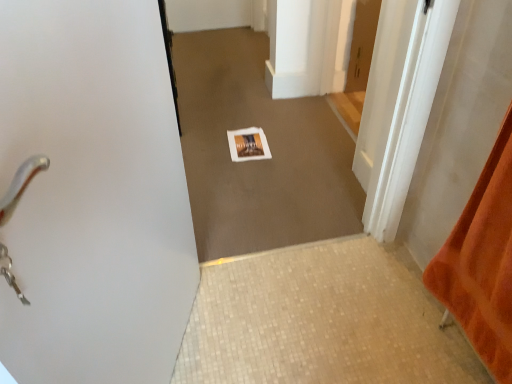
Question: Is orange fabric at right looking in the opposite direction of wooden door at center, arranged as the 2th door when viewed from the back?

Choices:
 (A) no
 (B) yes

Answer: (A)

Question: Is orange fabric at right touching wooden door at center, arranged as the 2th door when viewed from the back?

Choices:
 (A) no
 (B) yes

Answer: (A)

Question: From the image's perspective, does orange fabric at right appear lower than wooden door at center, the first door when ordered from front to back?

Choices:
 (A) yes
 (B) no

Answer: (A)

Question: Can you confirm if orange fabric at right is taller than wooden door at center, the first door when ordered from front to back?

Choices:
 (A) yes
 (B) no

Answer: (A)

Question: From a real-world perspective, does orange fabric at right sit lower than wooden door at center, the first door when ordered from front to back?

Choices:
 (A) no
 (B) yes

Answer: (A)

Question: Considering their positions, is wooden door at center, arranged as the 2th door when viewed from the back, located in front of or behind beige mosaic tile at lower center?

Choices:
 (A) front
 (B) behind

Answer: (B)

Question: Is wooden door at center, the first door when ordered from front to back, inside or outside of beige mosaic tile at lower center?

Choices:
 (A) outside
 (B) inside

Answer: (A)

Question: Is wooden door at center, arranged as the 2th door when viewed from the back, taller or shorter than beige mosaic tile at lower center?

Choices:
 (A) tall
 (B) short

Answer: (A)

Question: Is wooden door at center, arranged as the 2th door when viewed from the back, wider or thinner than beige mosaic tile at lower center?

Choices:
 (A) thin
 (B) wide

Answer: (A)

Question: Is wooden door at center, the first door when ordered from front to back, wider or thinner than white paper at center?

Choices:
 (A) wide
 (B) thin

Answer: (A)

Question: Looking at the image, does wooden door at center, the first door when ordered from front to back, seem bigger or smaller compared to white paper at center?

Choices:
 (A) big
 (B) small

Answer: (A)

Question: Considering their positions, is wooden door at center, arranged as the 2th door when viewed from the back, located in front of or behind white paper at center?

Choices:
 (A) behind
 (B) front

Answer: (A)

Question: From a real-world perspective, is wooden door at center, the first door when ordered from front to back, physically located above or below white paper at center?

Choices:
 (A) above
 (B) below

Answer: (B)

Question: Based on their sizes in the image, would you say wooden door at center, arranged as the 2th door when viewed from the back, is bigger or smaller than orange fabric at right?

Choices:
 (A) small
 (B) big

Answer: (B)

Question: In terms of width, does wooden door at center, arranged as the 2th door when viewed from the back, look wider or thinner when compared to orange fabric at right?

Choices:
 (A) wide
 (B) thin

Answer: (A)